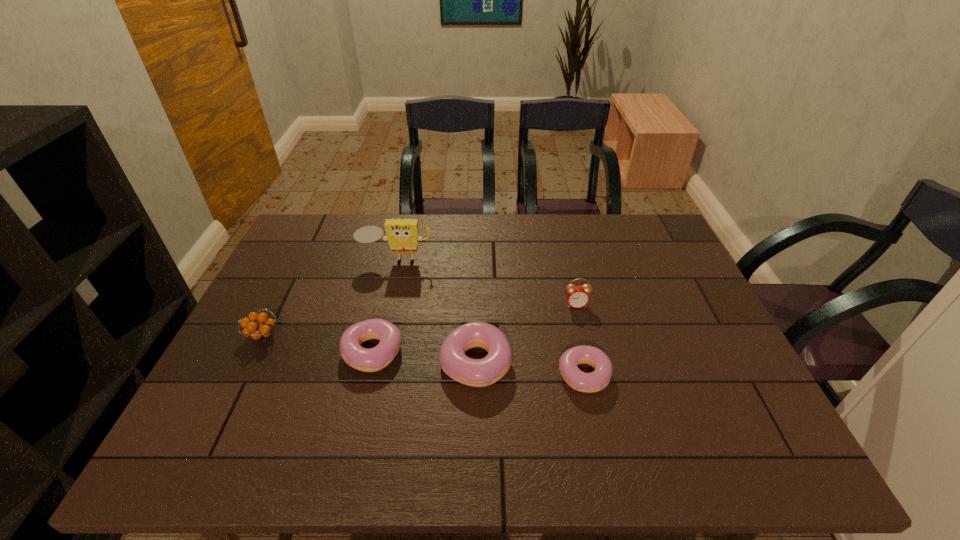
Image resolution: width=960 pixels, height=540 pixels. I want to click on vacant space at the right edge, so click(x=636, y=271).

In order to click on vacant space at the far left corner of the desktop in this screenshot , I will do `click(334, 244)`.

Where is `vacant area at the near left corner`? vacant area at the near left corner is located at coordinates (205, 402).

The width and height of the screenshot is (960, 540). I want to click on vacant space at the far right corner of the desktop, so click(x=671, y=255).

In the image, there is a desktop. Where is `vacant space at the near right corner`? The height and width of the screenshot is (540, 960). vacant space at the near right corner is located at coordinates (726, 393).

Identify the location of vacant area that lies between the shortest doughnut and the fifth nearest object. point(580,340).

Where is `empty space between the shortest doughnut and the fourth object from left to right`? empty space between the shortest doughnut and the fourth object from left to right is located at coordinates (530, 368).

At what (x,y) coordinates should I click in order to perform the action: click on empty space that is in between the leftmost object and the shortest object. Please return your answer as a coordinate pair (x, y). This screenshot has height=540, width=960. Looking at the image, I should click on (423, 355).

At what (x,y) coordinates should I click in order to perform the action: click on free point between the second doughnut from left to right and the second tallest doughnut. Please return your answer as a coordinate pair (x, y). Looking at the image, I should click on tap(424, 357).

Where is `free spot between the fourth object from left to right and the tallest object`? This screenshot has height=540, width=960. free spot between the fourth object from left to right and the tallest object is located at coordinates (436, 312).